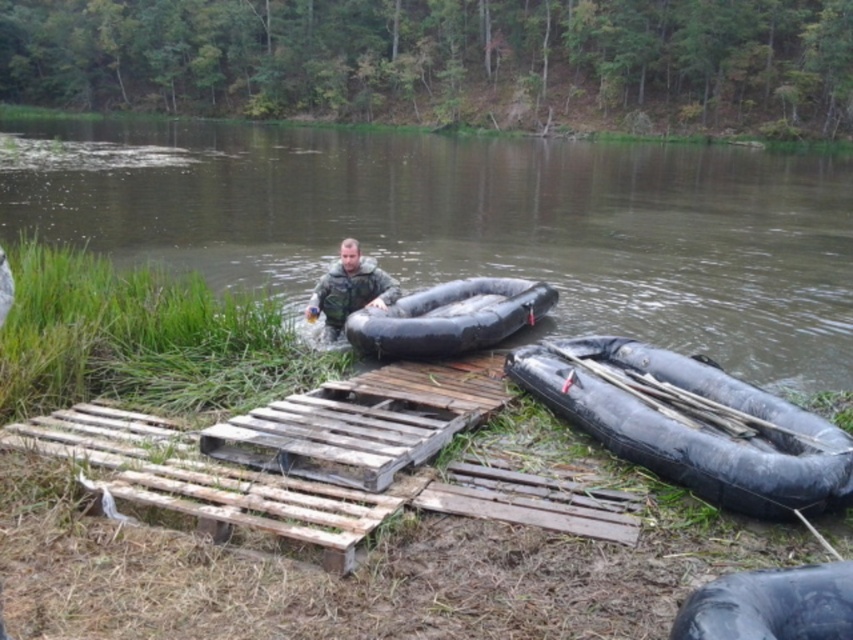
Can you confirm if black rubber tire at lower right is positioned to the left of camouflage fabric man at center?

In fact, black rubber tire at lower right is to the right of camouflage fabric man at center.

Who is lower down, black rubber tire at lower right or camouflage fabric man at center?

black rubber tire at lower right is below.

Does point (689, 620) come in front of point (392, 291)?

Yes, point (689, 620) is in front of point (392, 291).

Image resolution: width=853 pixels, height=640 pixels. Identify the location of black rubber tire at lower right. pyautogui.click(x=770, y=605).

Does black rubber canoe at center have a lesser width compared to black rubber tire at lower right?

No, black rubber canoe at center is not thinner than black rubber tire at lower right.

Measure the distance between point (419,291) and camera.

11.32 meters

Is point (397, 348) closer to camera compared to point (701, 634)?

That is False.

Locate an element on the screen. black rubber canoe at center is located at coordinates (450, 317).

Between black rubber canoe at center and camouflage fabric man at center, which one is positioned lower?

black rubber canoe at center is below.

Can you confirm if black rubber canoe at center is wider than camouflage fabric man at center?

Yes, black rubber canoe at center is wider than camouflage fabric man at center.

Is point (450, 296) less distant than point (329, 292)?

No, it is behind (329, 292).

You are a GUI agent. You are given a task and a screenshot of the screen. Output one action in this format:
    pyautogui.click(x=<x>, y=<y>)
    Task: Click on the black rubber canoe at center
    The image size is (853, 640).
    Given the screenshot: What is the action you would take?
    pyautogui.click(x=450, y=317)